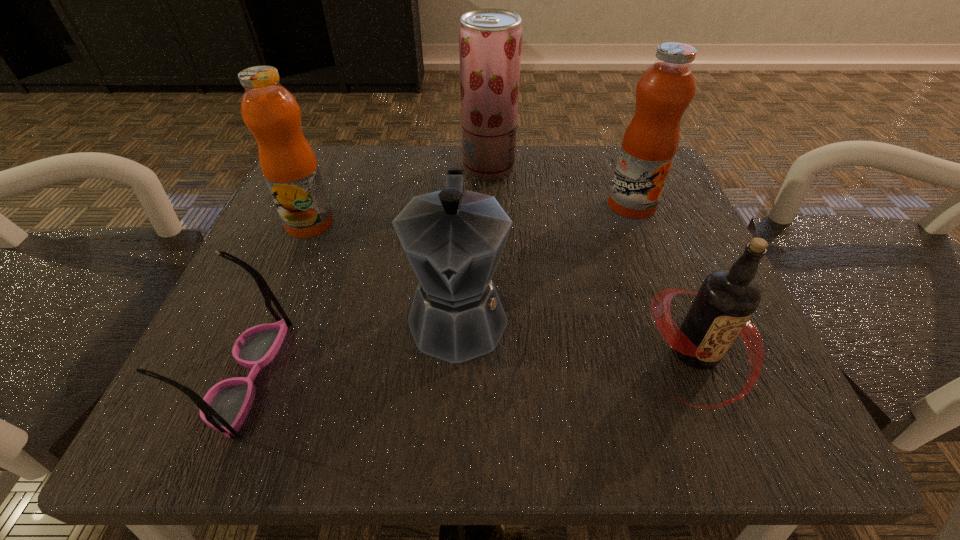
Identify which object is the fifth closest to the shortest object. Please provide its 2D coordinates. Your answer should be formatted as a tuple, i.e. [(x, y)], where the tuple contains the x and y coordinates of a point satisfying the conditions above.

[(664, 91)]

Identify which fruit juice is the closest to the root beer. Please provide its 2D coordinates. Your answer should be formatted as a tuple, i.e. [(x, y)], where the tuple contains the x and y coordinates of a point satisfying the conditions above.

[(664, 91)]

Locate which fruit juice ranks in proximity to the root beer. Please provide its 2D coordinates. Your answer should be formatted as a tuple, i.e. [(x, y)], where the tuple contains the x and y coordinates of a point satisfying the conditions above.

[(664, 91)]

Where is `free space that satisfies the following two spatial constraints: 1. on the back side of the farthest object; 2. on the left side of the spectacles`? free space that satisfies the following two spatial constraints: 1. on the back side of the farthest object; 2. on the left side of the spectacles is located at coordinates (334, 168).